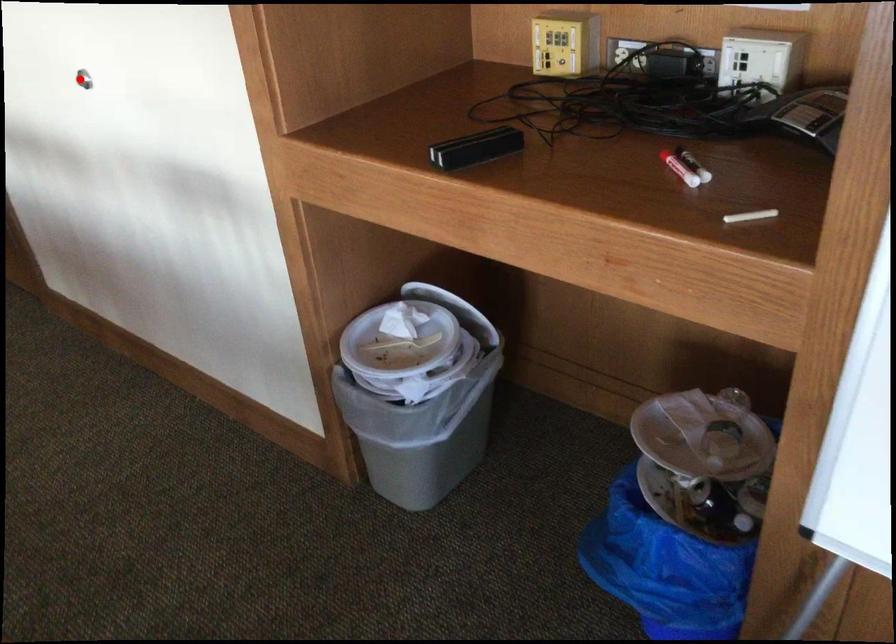
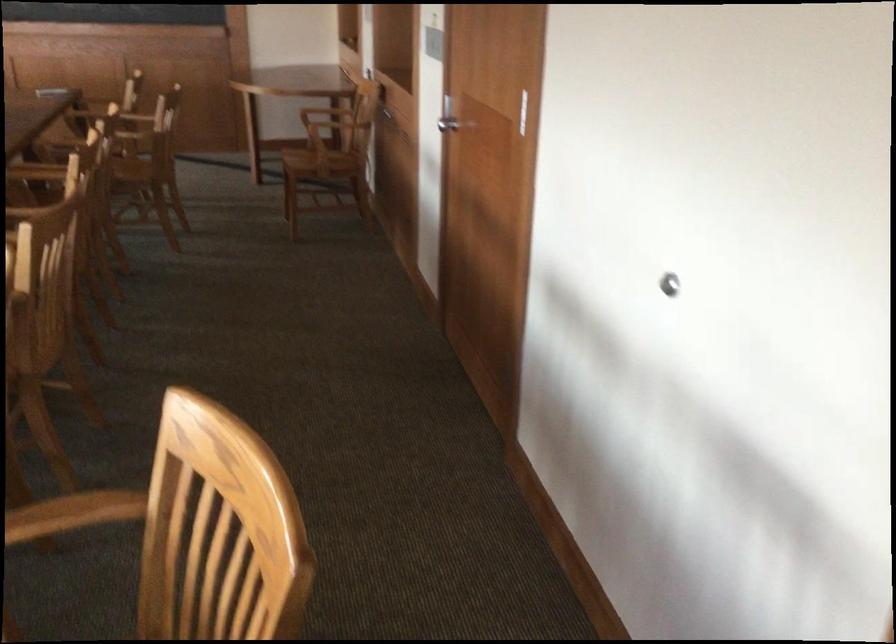
Question: A red point is marked in image1. In image2, is the corresponding 3D point closer to the camera or farther? Reply with the corresponding letter.

Choices:
 (A) The corresponding 3D point is closer.
 (B) The corresponding 3D point is farther.

Answer: (A)